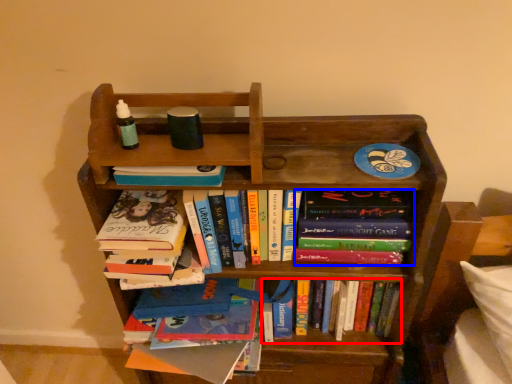
Question: Which object is further to the camera taking this photo, book (highlighted by a red box) or book (highlighted by a blue box)?

Choices:
 (A) book
 (B) book

Answer: (A)